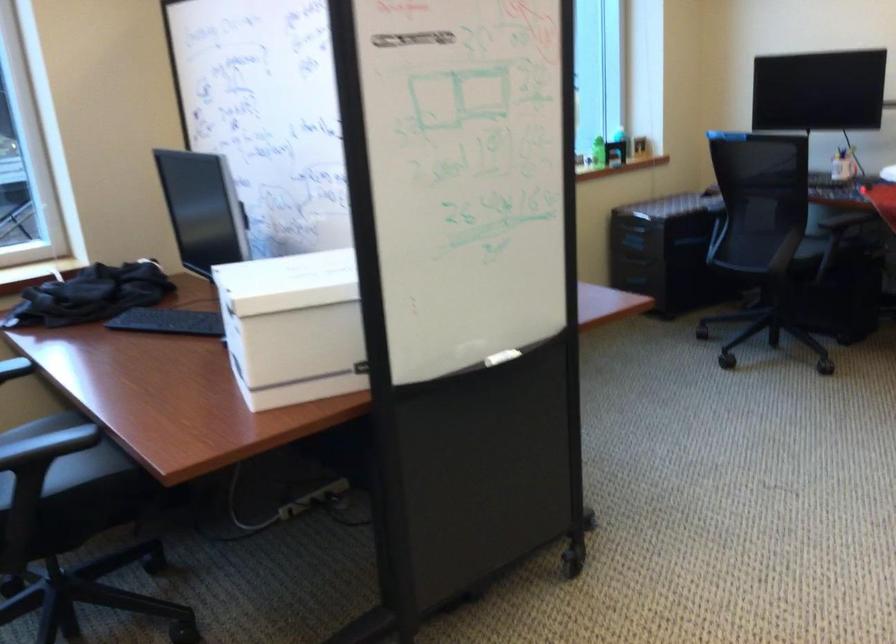
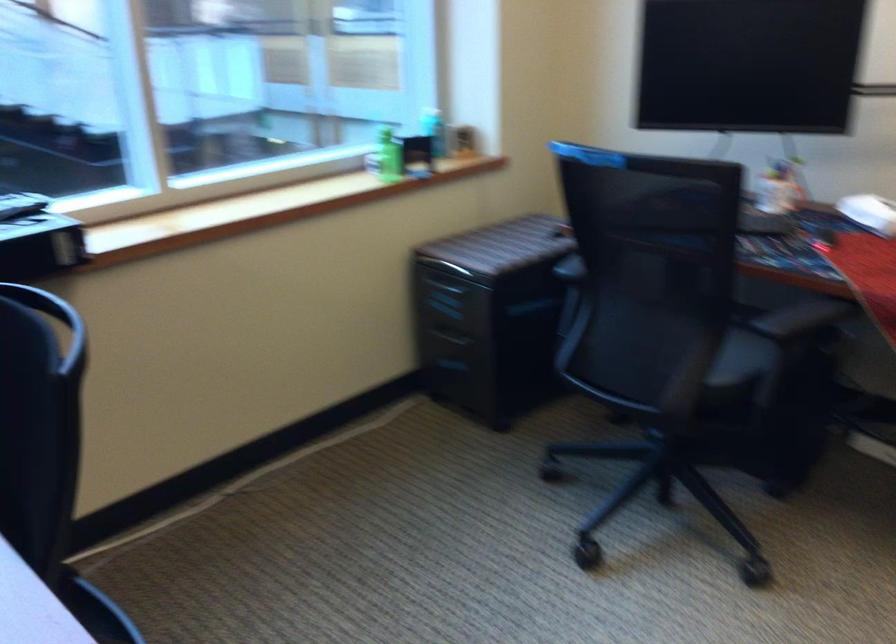
Consider the image. Which direction would the cameraman need to move to produce the second image?

The movement direction of the cameraman is right, forward.